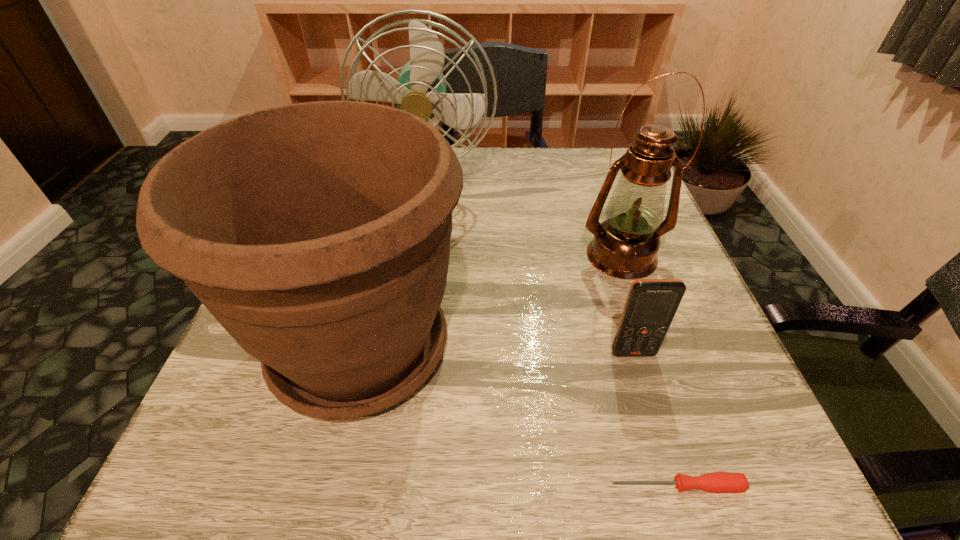
The height and width of the screenshot is (540, 960). Find the location of `fan`. fan is located at coordinates pyautogui.click(x=420, y=89).

At what (x,y) coordinates should I click in order to perform the action: click on oil lamp. Please return your answer as a coordinate pair (x, y). This screenshot has height=540, width=960. Looking at the image, I should click on (625, 245).

Find the location of a particular element. The width and height of the screenshot is (960, 540). flowerpot is located at coordinates (317, 234).

The image size is (960, 540). In order to click on cellular telephone in this screenshot , I will do `click(651, 305)`.

Where is `the shortest object`? The height and width of the screenshot is (540, 960). the shortest object is located at coordinates (720, 482).

Locate an element on the screen. The image size is (960, 540). screwdriver is located at coordinates (720, 482).

At what (x,y) coordinates should I click in order to perform the action: click on vacant position located 0.220m in front of the farthest object, directing airflow. Please return your answer as a coordinate pair (x, y). This screenshot has height=540, width=960. Looking at the image, I should click on (413, 293).

At what (x,y) coordinates should I click in order to perform the action: click on free region located on the left of the oil lamp. Please return your answer as a coordinate pair (x, y). Image resolution: width=960 pixels, height=540 pixels. Looking at the image, I should click on (386, 256).

You are a GUI agent. You are given a task and a screenshot of the screen. Output one action in this format:
    pyautogui.click(x=<x>, y=<y>)
    Task: Click on the vacant space located on the right of the flowerpot
    
    Given the screenshot: What is the action you would take?
    pyautogui.click(x=705, y=347)

This screenshot has height=540, width=960. Find the location of `vacant space positioned on the screen of the second shortest object`. vacant space positioned on the screen of the second shortest object is located at coordinates (679, 503).